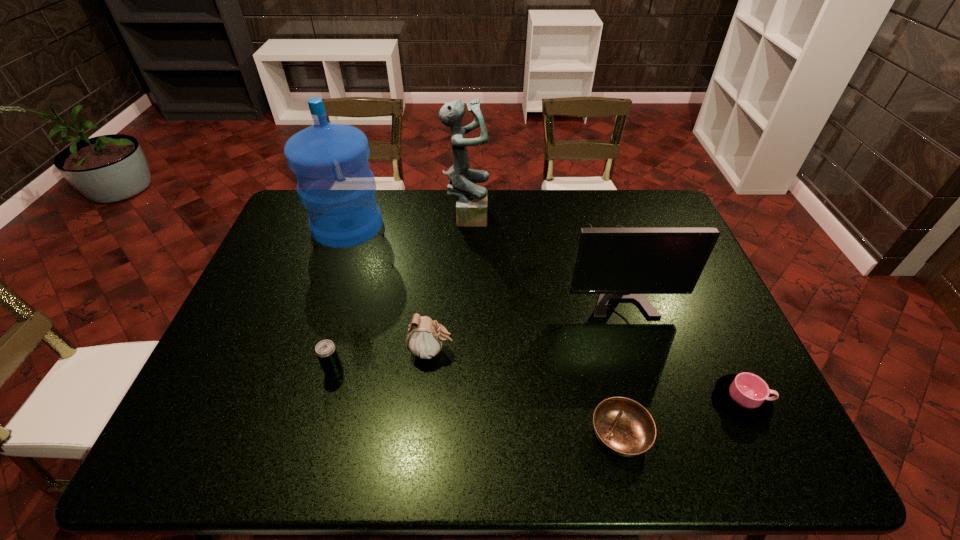
Identify the location of free space that satisfies the following two spatial constraints: 1. on the front-facing side of the soup bowl; 2. on the right side of the fourth shortest object. The image size is (960, 540). (423, 434).

This screenshot has width=960, height=540. Identify the location of vacant point that satisfies the following two spatial constraints: 1. on the front-facing side of the shortest object; 2. on the right side of the fourth shortest object. (423, 434).

Identify the location of free location that satisfies the following two spatial constraints: 1. on the front side of the soup bowl; 2. on the right side of the third shortest object. (318, 434).